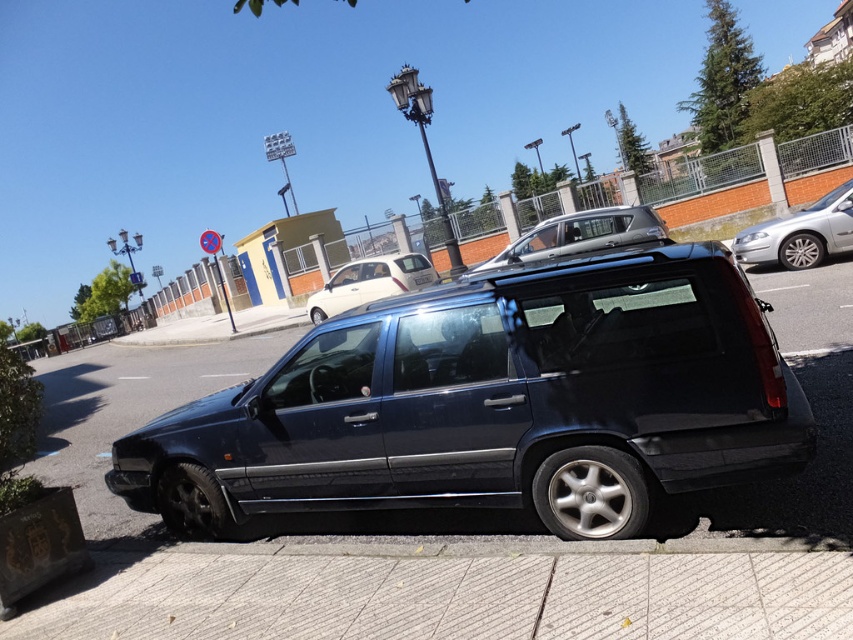
Based on the photo, between silver metallic sedan at right and white glossy hatchback at center, which one appears on the right side from the viewer's perspective?

silver metallic sedan at right is more to the right.

Which is in front, point (849, 220) or point (341, 289)?

Point (849, 220)

Is point (839, 230) positioned behind point (323, 291)?

No, it is in front of (323, 291).

This screenshot has width=853, height=640. I want to click on silver metallic sedan at right, so click(x=799, y=234).

Is point (540, 291) closer to viewer compared to point (325, 289)?

Yes.

Is glossy black minivan at center smaller than white glossy hatchback at center?

Actually, glossy black minivan at center might be larger than white glossy hatchback at center.

At what (x,y) coordinates should I click in order to perform the action: click on glossy black minivan at center. Please return your answer as a coordinate pair (x, y). Image resolution: width=853 pixels, height=640 pixels. Looking at the image, I should click on tap(494, 403).

Does glossy black minivan at center come behind silver metallic sedan at right?

No, it is not.

Consider the image. Is the position of glossy black minivan at center less distant than that of silver metallic sedan at right?

Yes, glossy black minivan at center is closer to the viewer.

Between point (294, 444) and point (819, 243), which one is positioned in front?

Point (294, 444)

Identify the location of glossy black minivan at center. (494, 403).